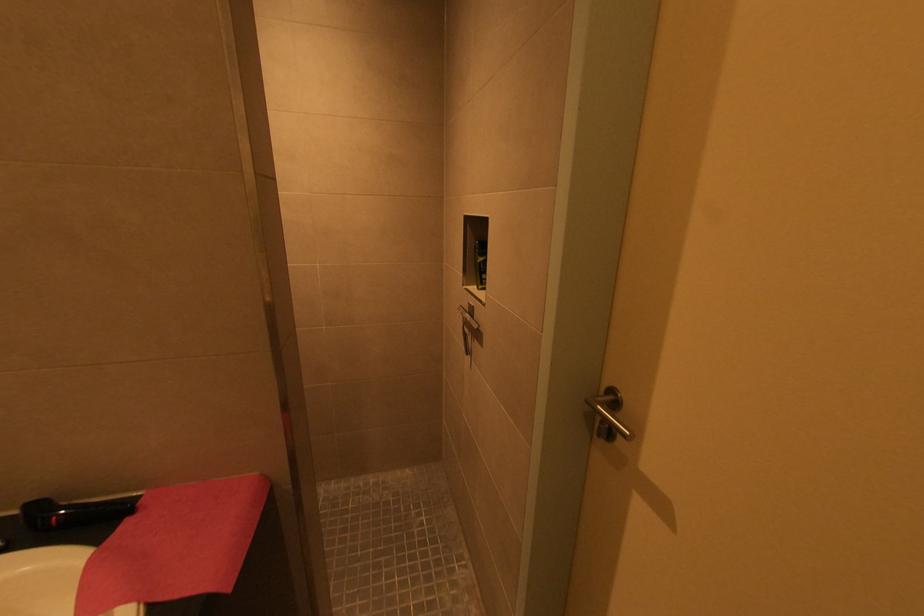
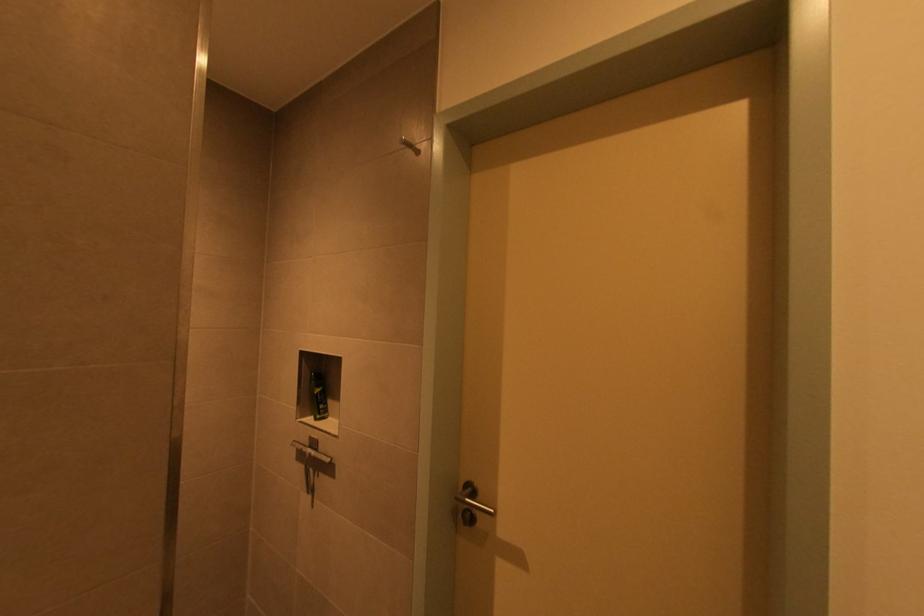
Question: How did the camera likely rotate?

Choices:
 (A) Left
 (B) Right
 (C) Up
 (D) Down

Answer: (B)